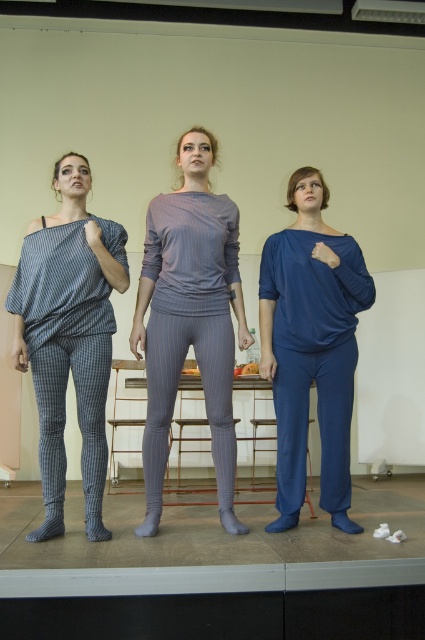
Between blue fabric stage at lower center and blue striped tights at left, which one has more height?

Standing taller between the two is blue striped tights at left.

Image resolution: width=425 pixels, height=640 pixels. In order to click on blue fabric stage at lower center in this screenshot , I will do `click(215, 572)`.

The width and height of the screenshot is (425, 640). Identify the location of blue fabric stage at lower center. (215, 572).

Who is positioned more to the right, blue striped tights at left or blue striped tights at center?

From the viewer's perspective, blue striped tights at center appears more on the right side.

Does blue striped tights at left appear on the right side of blue striped tights at center?

In fact, blue striped tights at left is to the left of blue striped tights at center.

Who is more distant from viewer, [40,348] or [214,321]?

Point [214,321]

The width and height of the screenshot is (425, 640). In order to click on blue striped tights at left in this screenshot , I will do `click(78, 422)`.

Does striped fabric pants at left have a lesser height compared to matte blue pants at center?

No, striped fabric pants at left is not shorter than matte blue pants at center.

This screenshot has width=425, height=640. What do you see at coordinates (68, 336) in the screenshot?
I see `striped fabric pants at left` at bounding box center [68, 336].

Between point (96, 531) and point (283, 273), which one is positioned in front?

Point (96, 531) is more forward.

Locate an element on the screen. The width and height of the screenshot is (425, 640). striped fabric pants at left is located at coordinates (68, 336).